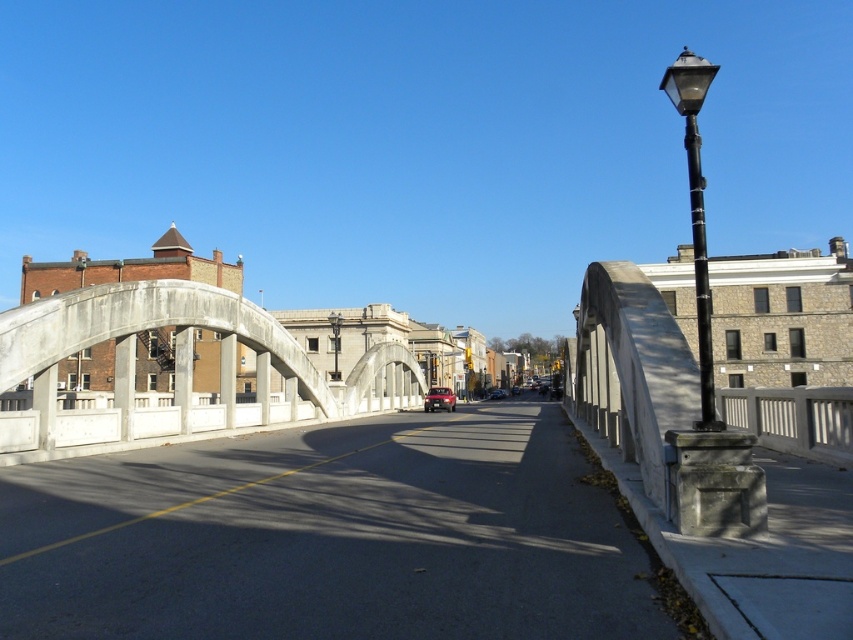
You are an architect assessing the structural integrity of the concrete bridge at center and the black polished metal streetlight at center. Which structure has a higher elevation from the ground?

The concrete bridge at center has a greater height compared to the black polished metal streetlight at center, so the concrete bridge at center is higher in elevation from the ground.

You are a maintenance worker needing to inspect both the concrete bridge at center and the black polished metal streetlight at center. Given that you can walk at 3 miles per hour, how many minutes will it take you to walk from one to the other?

The distance between the concrete bridge at center and the black polished metal streetlight at center is 96.54 feet. Converting this to miles, 96.54 feet is approximately 0.0183 miles. At a walking speed of 3 mph, the time taken would be distance divided by speed, so 0.0183 miles divided by 3 mph equals approximately 0.0061 hours. Converting hours to minutes by multiplying by 60 gives roughly 0.366 minutes, which is about 22 seconds. Therefore, it would take roughly 0.37 minutes or approximately 22 seconds.